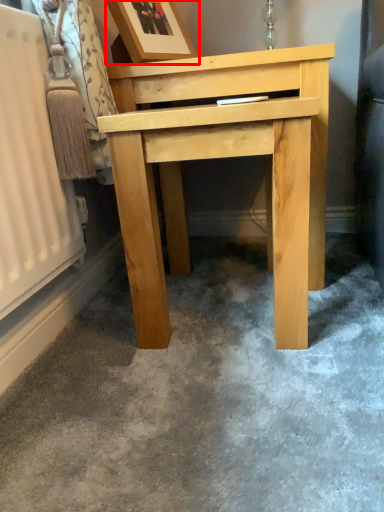
Question: From the image's perspective, what is the correct spatial relationship of picture frame (annotated by the red box) in relation to table?

Choices:
 (A) above
 (B) below

Answer: (A)